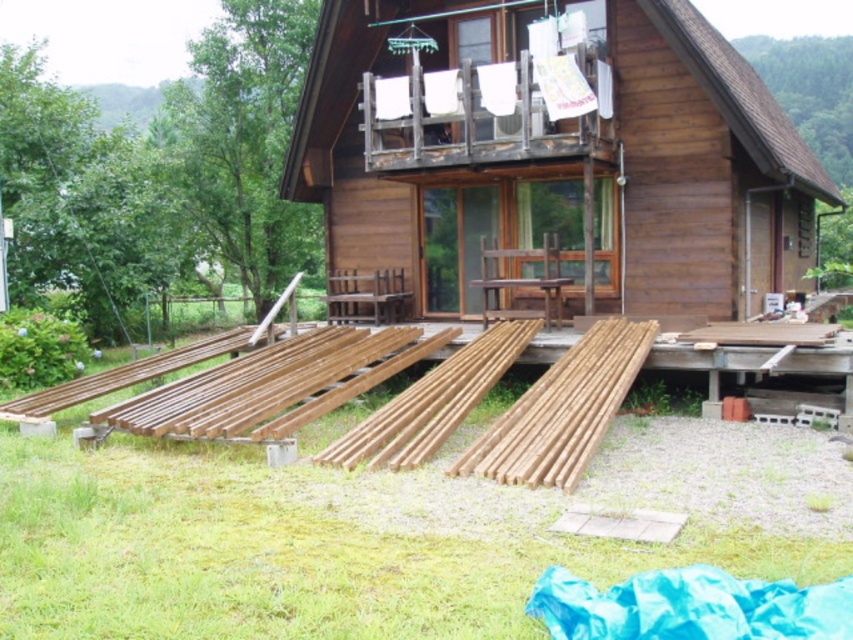
You are standing in front of the wooden cabin at center and want to pick up the natural wood planks at lower center. Are the planks in front of or behind the cabin?

The natural wood planks at lower center are behind the wooden cabin at center, so they are not directly accessible from your current position in front of the cabin.

You are standing at the point marked by coordinates point (553, 154). Looking around, you see the wooden cabin at center. Where is the wooden cabin located relative to your current position?

The wooden cabin at center is located exactly at your current position marked by point (553, 154).